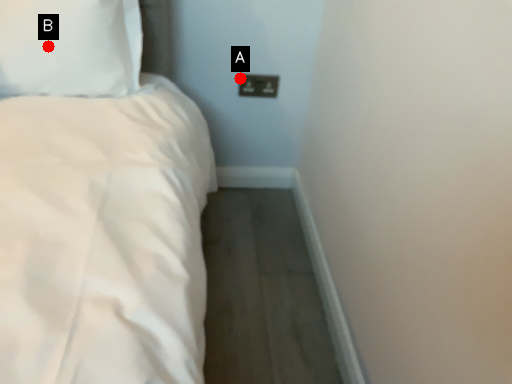
Question: Two points are circled on the image, labeled by A and B beside each circle. Which point is closer to the camera taking this photo?

Choices:
 (A) A is closer
 (B) B is closer

Answer: (B)